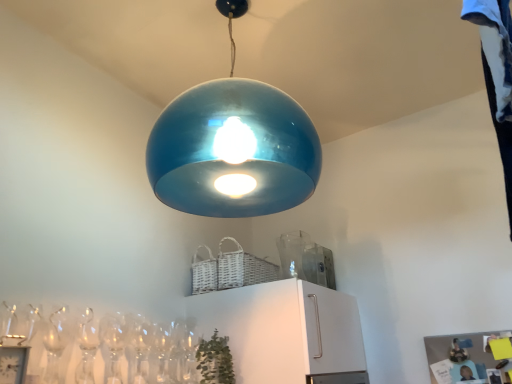
Question: Can glossy blue pendant light at center be found inside transparent glass vase at upper center?

Choices:
 (A) no
 (B) yes

Answer: (A)

Question: Is transparent glass vase at upper center thinner than glossy blue pendant light at center?

Choices:
 (A) yes
 (B) no

Answer: (A)

Question: From the image's perspective, is transparent glass vase at upper center above glossy blue pendant light at center?

Choices:
 (A) no
 (B) yes

Answer: (A)

Question: Is transparent glass vase at upper center looking in the opposite direction of glossy blue pendant light at center?

Choices:
 (A) no
 (B) yes

Answer: (A)

Question: Is there a large distance between transparent glass vase at upper center and glossy blue pendant light at center?

Choices:
 (A) no
 (B) yes

Answer: (A)

Question: From a real-world perspective, is transparent glass vase at upper center positioned above or below green matte plant at lower center?

Choices:
 (A) above
 (B) below

Answer: (A)

Question: Considering the positions of point (291, 269) and point (211, 344), is point (291, 269) closer or farther from the camera than point (211, 344)?

Choices:
 (A) farther
 (B) closer

Answer: (A)

Question: Based on their sizes in the image, would you say transparent glass vase at upper center is bigger or smaller than green matte plant at lower center?

Choices:
 (A) big
 (B) small

Answer: (B)

Question: From the image's perspective, is transparent glass vase at upper center positioned above or below green matte plant at lower center?

Choices:
 (A) above
 (B) below

Answer: (A)

Question: In the image, is green matte plant at lower center positioned in front of or behind glossy blue pendant light at center?

Choices:
 (A) front
 (B) behind

Answer: (B)

Question: Does point (204, 364) appear closer or farther from the camera than point (155, 148)?

Choices:
 (A) closer
 (B) farther

Answer: (B)

Question: Is green matte plant at lower center to the left or to the right of glossy blue pendant light at center in the image?

Choices:
 (A) left
 (B) right

Answer: (A)

Question: From a real-world perspective, relative to glossy blue pendant light at center, is green matte plant at lower center vertically above or below?

Choices:
 (A) above
 (B) below

Answer: (B)

Question: Is glossy blue pendant light at center spatially inside transparent glass vase at upper center, or outside of it?

Choices:
 (A) inside
 (B) outside

Answer: (B)

Question: From the image's perspective, is glossy blue pendant light at center located above or below transparent glass vase at upper center?

Choices:
 (A) below
 (B) above

Answer: (B)